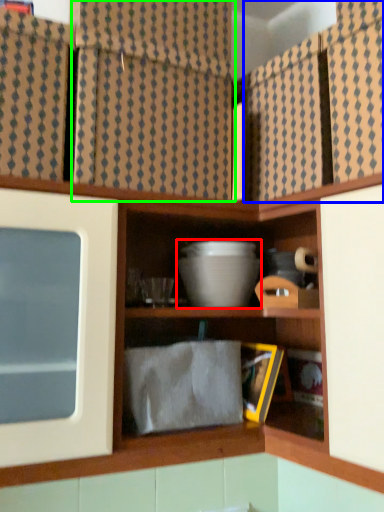
Question: Which object is positioned farthest from mixing bowl (highlighted by a red box)? Select from cabinet (highlighted by a blue box) and curtain (highlighted by a green box).

Choices:
 (A) cabinet
 (B) curtain

Answer: (B)